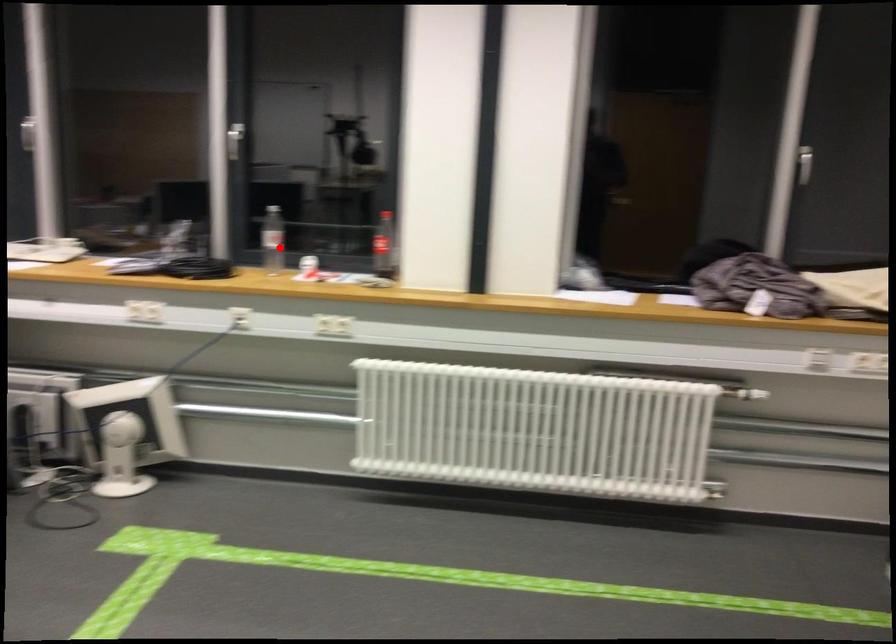
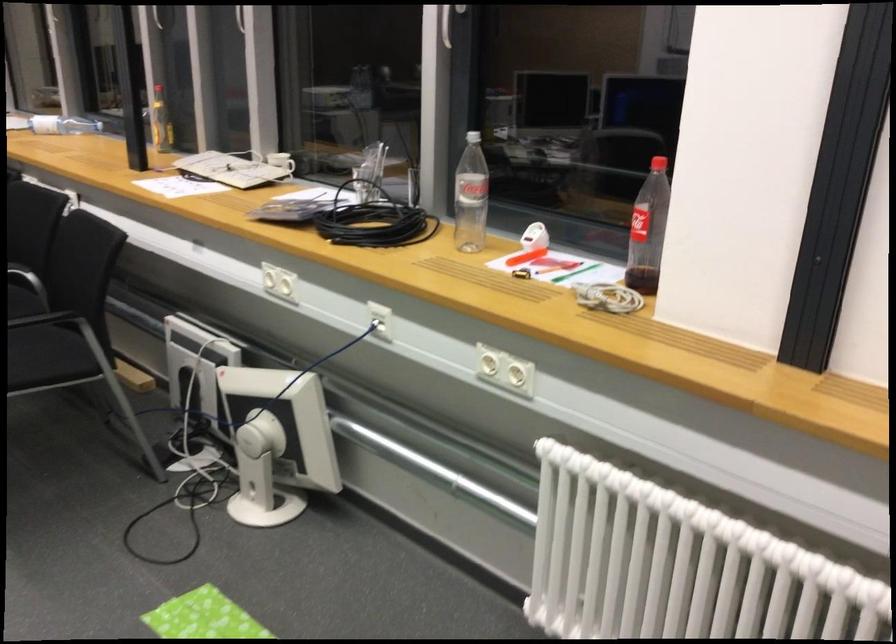
Where in the second image is the point corresponding to the highlighted location from the first image?

(470, 196)